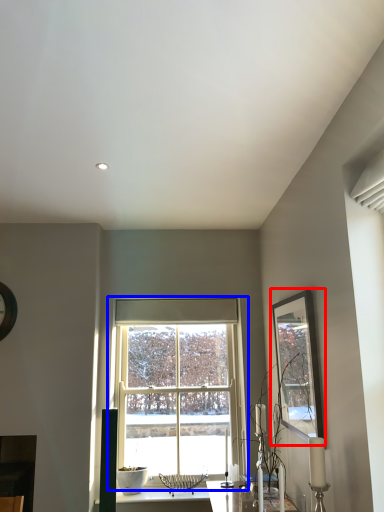
Question: Which of the following is the closest to the observer, picture frame (highlighted by a red box) or window (highlighted by a blue box)?

Choices:
 (A) picture frame
 (B) window

Answer: (A)